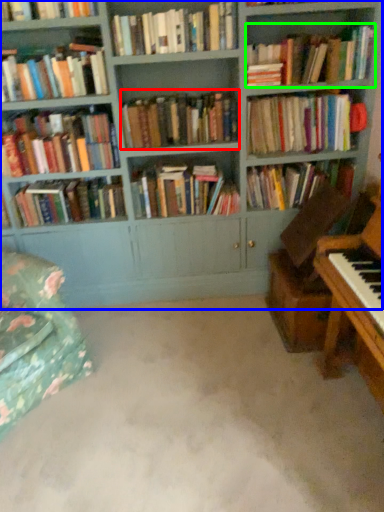
Question: Estimate the real-world distances between objects in this image. Which object is farther from book (highlighted by a red box), bookcase (highlighted by a blue box) or book (highlighted by a green box)?

Choices:
 (A) bookcase
 (B) book

Answer: (B)